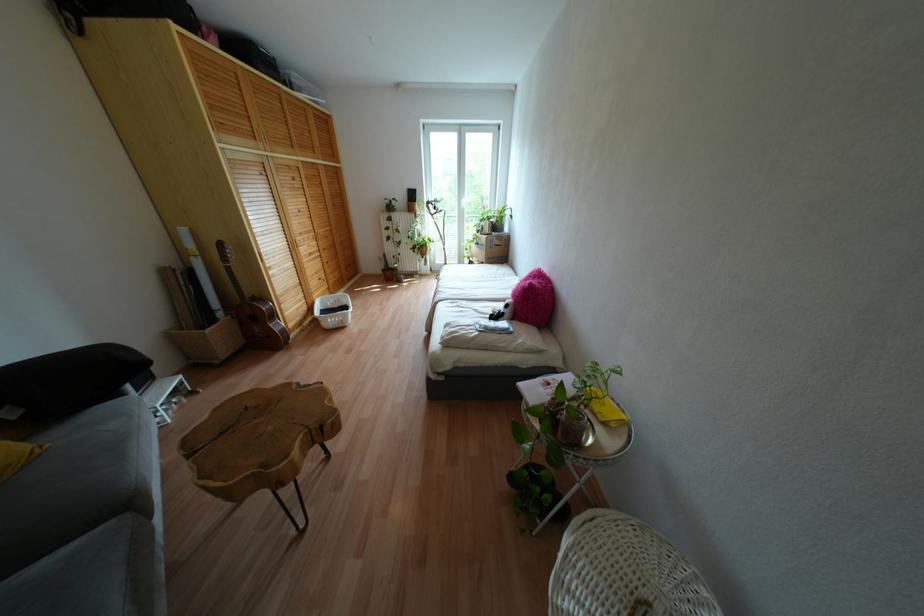
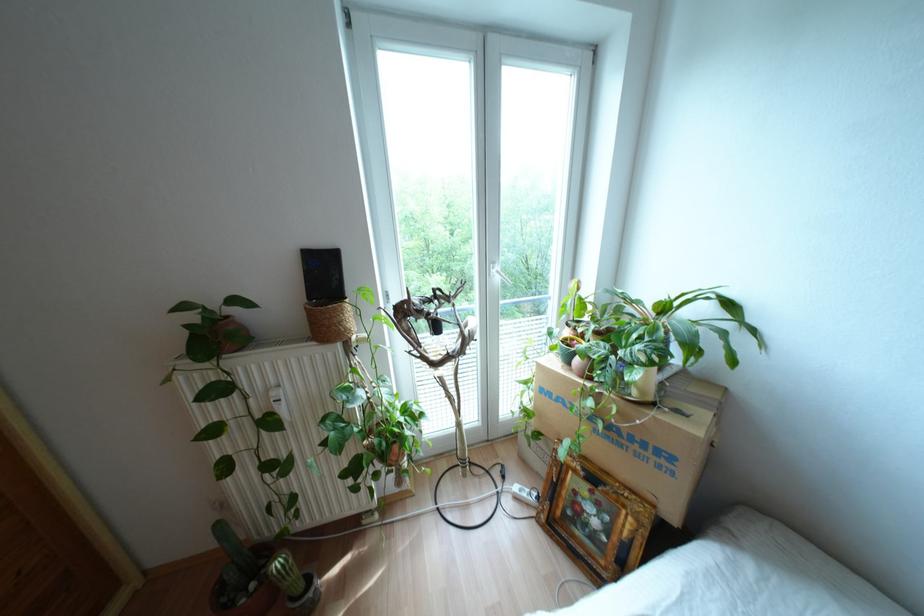
Question: Which direction would the cameraman need to move to produce the second image? Reply with the corresponding letter.

Choices:
 (A) Left
 (B) Right
 (C) Forward
 (D) Backward

Answer: (C)